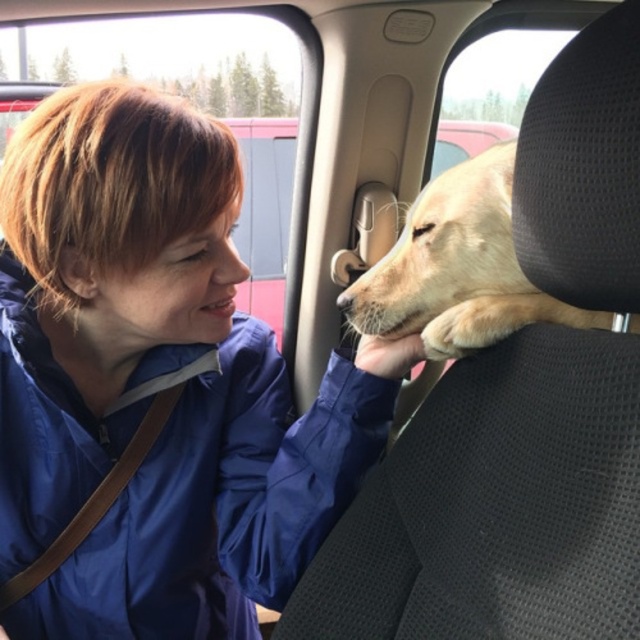
Is transparent glass window at upper center to the right of golden fur dog at center from the viewer's perspective?

In fact, transparent glass window at upper center is to the left of golden fur dog at center.

Does transparent glass window at upper center have a larger size compared to golden fur dog at center?

Indeed, transparent glass window at upper center has a larger size compared to golden fur dog at center.

What do you see at coordinates (195, 100) in the screenshot?
I see `transparent glass window at upper center` at bounding box center [195, 100].

This screenshot has width=640, height=640. I want to click on transparent glass window at upper center, so click(195, 100).